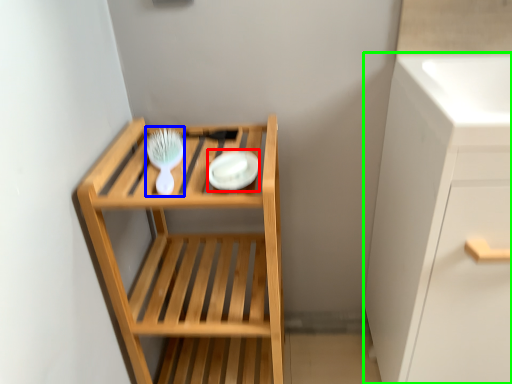
Question: Estimate the real-world distances between objects in this image. Which object is farther from platter (highlighted by a red box), brush (highlighted by a blue box) or cabinetry (highlighted by a green box)?

Choices:
 (A) brush
 (B) cabinetry

Answer: (B)